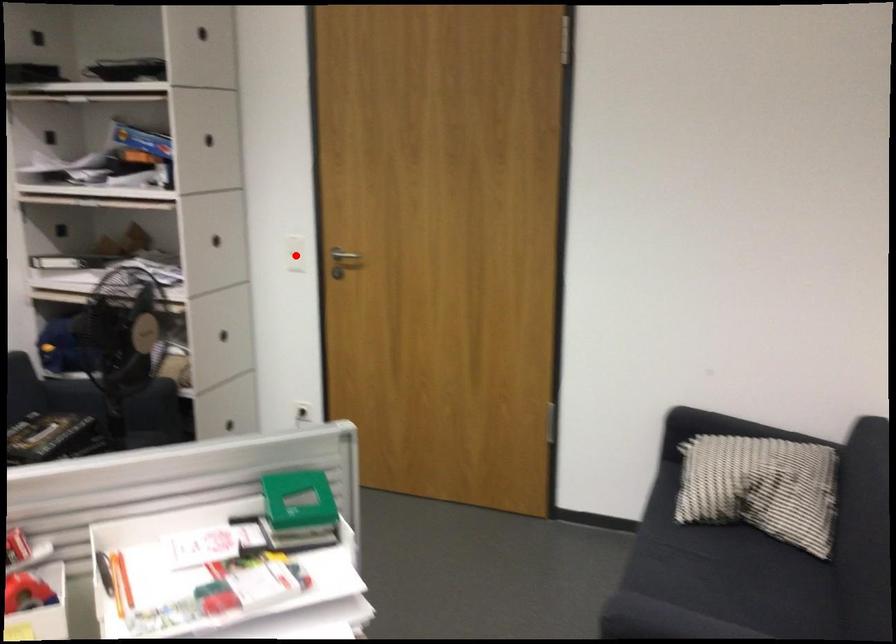
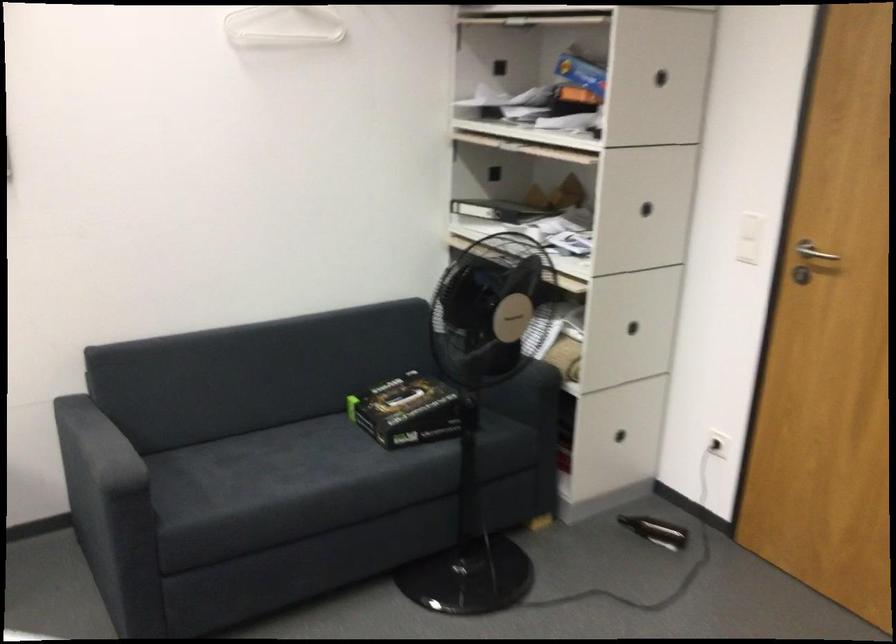
Where in the second image is the point corresponding to the highlighted location from the first image?

(748, 238)